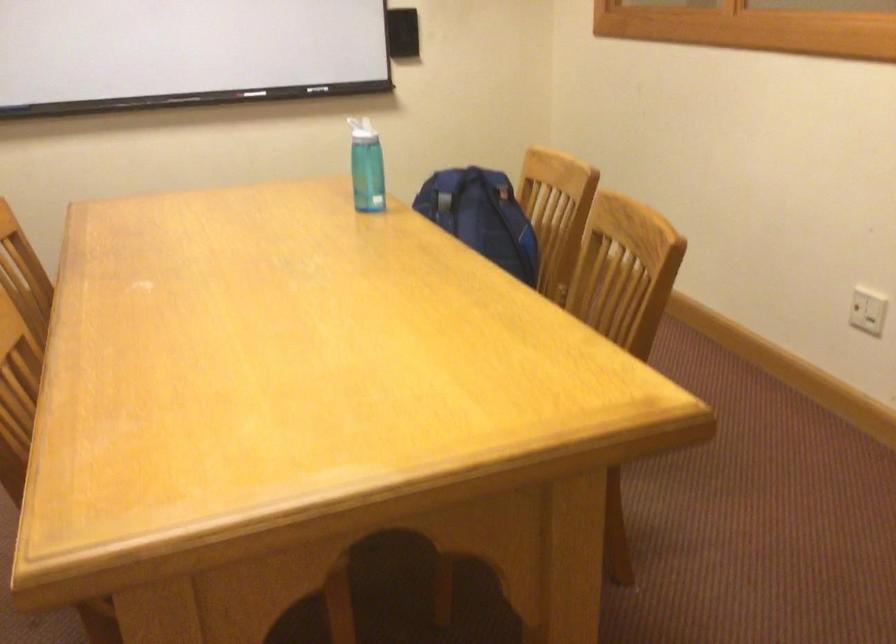
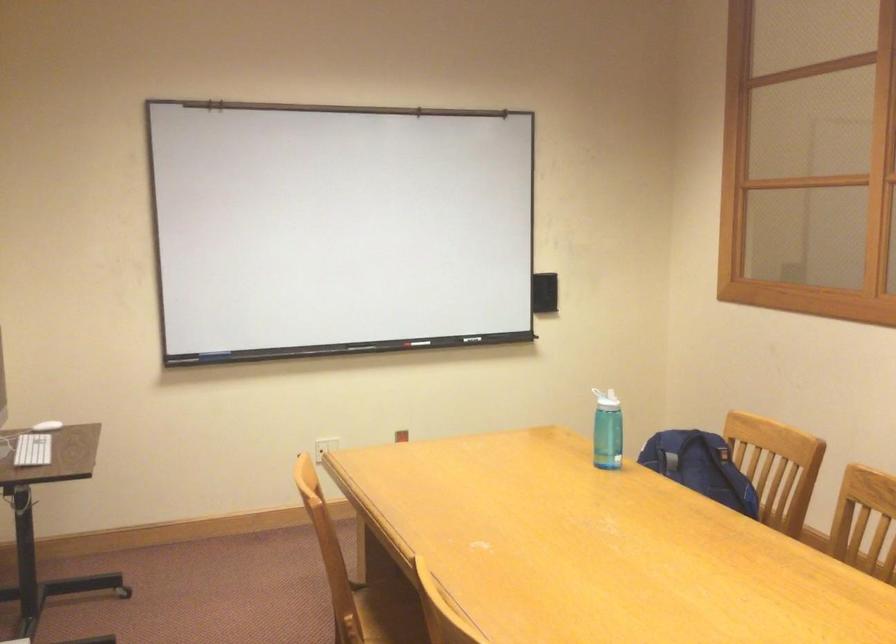
In the second image, find the point that corresponds to [254,93] in the first image.

(420, 343)